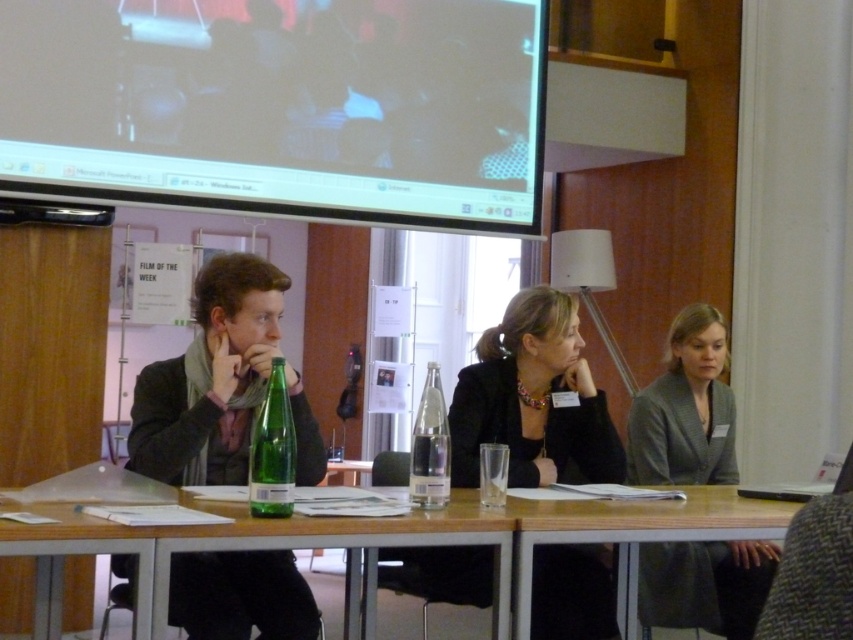
Question: Which point is closer to the camera taking this photo?

Choices:
 (A) (254, 490)
 (B) (544, 577)
 (C) (778, 532)

Answer: (A)

Question: Does matte black projector screen at upper center have a smaller size compared to matte black jacket at center?

Choices:
 (A) yes
 (B) no

Answer: (B)

Question: Is matte black jacket at center to the right of dark gray suit at center from the viewer's perspective?

Choices:
 (A) no
 (B) yes

Answer: (A)

Question: Which of the following is the closest to the observer?

Choices:
 (A) green glass bottle at center
 (B) wooden table at lower center

Answer: (A)

Question: Can you confirm if dark gray suit at center is positioned to the right of green glass bottle at center?

Choices:
 (A) no
 (B) yes

Answer: (B)

Question: Which of the following is the closest to the observer?

Choices:
 (A) black leather jacket at center
 (B) clear glass bottle at center

Answer: (B)